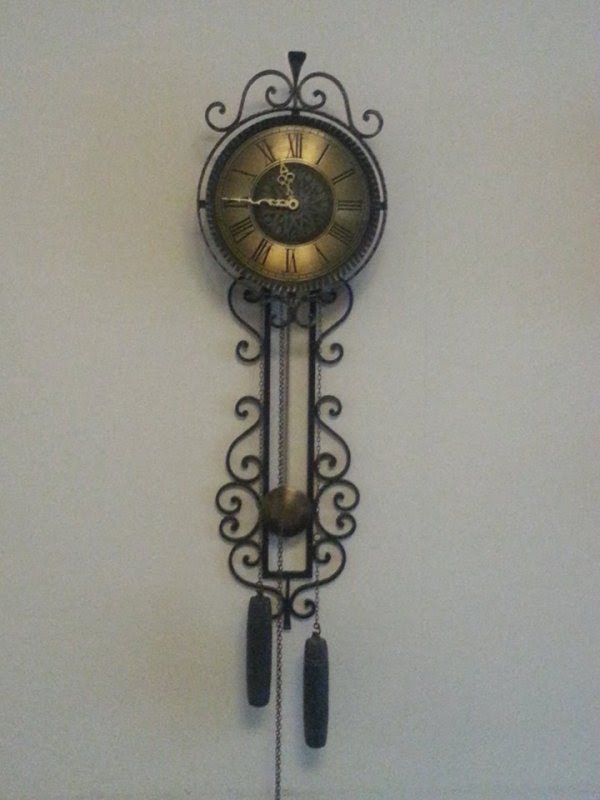
You are a GUI agent. You are given a task and a screenshot of the screen. Output one action in this format:
    pyautogui.click(x=<x>, y=<y>)
    Task: Click on the wall
    Image resolution: width=600 pixels, height=800 pixels.
    Given the screenshot: What is the action you would take?
    pyautogui.click(x=468, y=553)